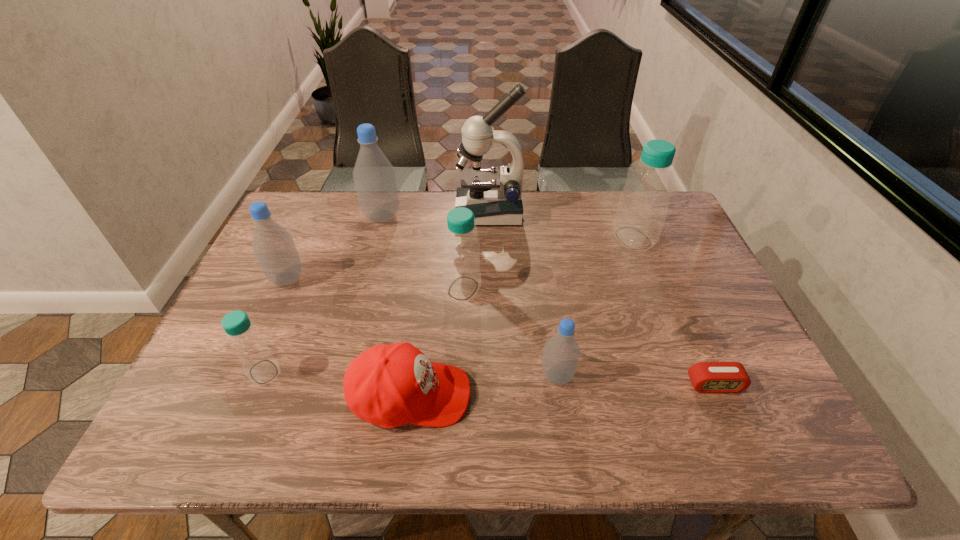
I want to click on microscope, so click(x=495, y=198).

Identify the location of the biggest gray bottle. (374, 176).

The image size is (960, 540). Find the location of `the farthest gray bottle`. the farthest gray bottle is located at coordinates (374, 176).

Locate an element on the screen. The width and height of the screenshot is (960, 540). the rightmost bottle is located at coordinates (643, 204).

Identify the location of the biggest blue bottle. (643, 204).

I want to click on the leftmost gray bottle, so click(x=274, y=248).

At what (x,y) coordinates should I click in order to perform the action: click on the second farthest gray bottle. Please return your answer as a coordinate pair (x, y). Looking at the image, I should click on (274, 248).

Find the location of `the second blue bottle from right to left`. the second blue bottle from right to left is located at coordinates point(461,247).

At what (x,y) coordinates should I click in order to perform the action: click on the second biggest blue bottle. Please return your answer as a coordinate pair (x, y). Looking at the image, I should click on (461, 247).

I want to click on the smallest gray bottle, so click(x=561, y=354).